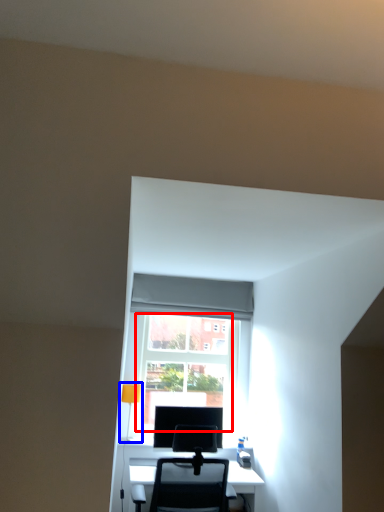
Question: Which point is closer to the camera, glass door (highlighted by a red box) or table lamp (highlighted by a blue box)?

Choices:
 (A) glass door
 (B) table lamp

Answer: (B)